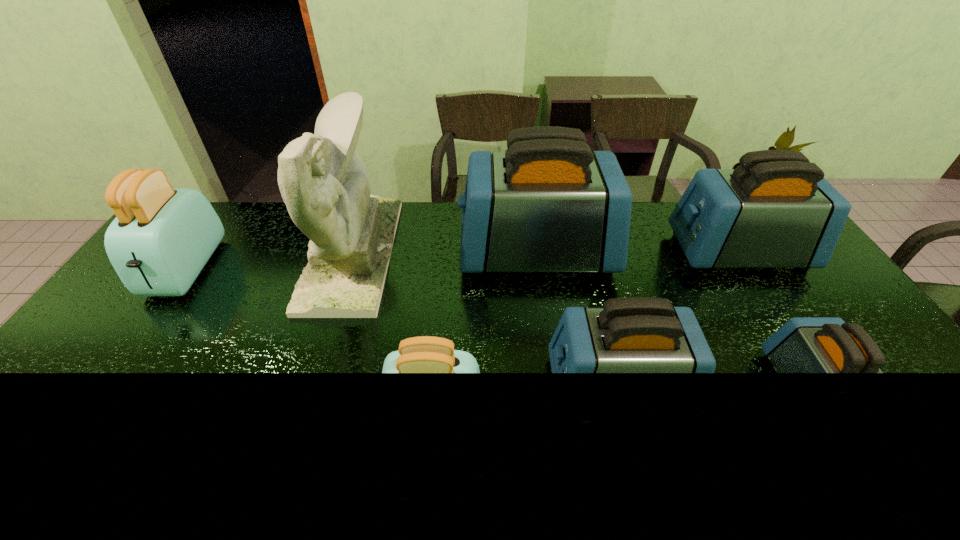
Locate an element on the screen. The height and width of the screenshot is (540, 960). the smallest blue toaster is located at coordinates (803, 344).

This screenshot has width=960, height=540. Find the location of `the shortest toaster`. the shortest toaster is located at coordinates (803, 344).

Locate an element on the screen. This screenshot has width=960, height=540. blank space located 0.110m on the base of the tallest object is located at coordinates (424, 253).

The height and width of the screenshot is (540, 960). What are the coordinates of `free space located on the front-facing side of the sixth shortest object` in the screenshot? It's located at (400, 253).

Find the location of a particular element. The image size is (960, 540). free space located 0.330m on the front-facing side of the sixth shortest object is located at coordinates (361, 253).

I want to click on free point located on the front-facing side of the sixth shortest object, so click(x=421, y=253).

I want to click on vacant area located on the front-facing side of the third smallest blue toaster, so [653, 253].

Identify the location of free region located 0.130m on the front-facing side of the third smallest blue toaster. Image resolution: width=960 pixels, height=540 pixels. (635, 253).

You are a GUI agent. You are given a task and a screenshot of the screen. Output one action in this format:
    pyautogui.click(x=<x>, y=<y>)
    Task: Click on the vacant space located on the front-facing side of the third smallest blue toaster
    Image resolution: width=960 pixels, height=540 pixels.
    Given the screenshot: What is the action you would take?
    pyautogui.click(x=616, y=253)

I want to click on free space located on the side of the bigger light toaster with the lever, so click(129, 350).